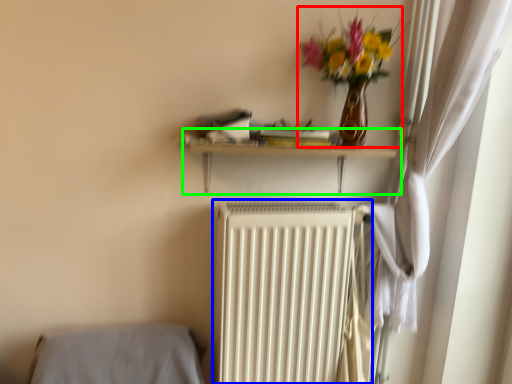
Question: Which is farther away from floral arrangement (highlighted by a red box)? radiator (highlighted by a blue box) or shelf (highlighted by a green box)?

Choices:
 (A) radiator
 (B) shelf

Answer: (A)